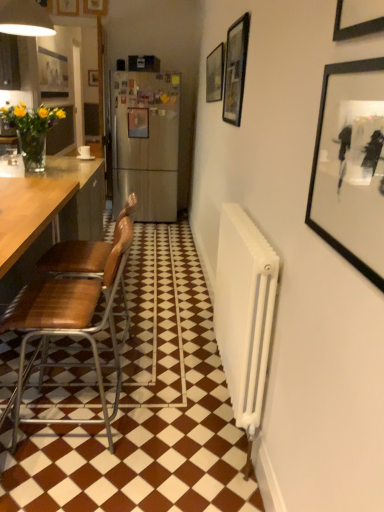
Question: Is brown leather chair at left, positioned as the 2th chair in front-to-back order, far away from matte black picture frame at upper center, marked as the fifth picture frame in a bottom-to-top arrangement?

Choices:
 (A) yes
 (B) no

Answer: (A)

Question: Is matte black picture frame at upper center, acting as the second picture frame starting from the top, a part of brown leather chair at left, positioned as the 1th chair in back-to-front order?

Choices:
 (A) yes
 (B) no

Answer: (B)

Question: Is brown leather chair at left, positioned as the 2th chair in front-to-back order, bigger than matte black picture frame at upper center, marked as the fifth picture frame in a bottom-to-top arrangement?

Choices:
 (A) yes
 (B) no

Answer: (A)

Question: Can you confirm if brown leather chair at left, positioned as the 1th chair in back-to-front order, is smaller than matte black picture frame at upper center, the 2th picture frame positioned from the left?

Choices:
 (A) no
 (B) yes

Answer: (A)

Question: Is brown leather chair at left, positioned as the 2th chair in front-to-back order, taller than matte black picture frame at upper center, the 2th picture frame positioned from the left?

Choices:
 (A) yes
 (B) no

Answer: (A)

Question: From the image's perspective, is black glass picture frame at upper center, the second picture frame in the front-to-back sequence, located above or below white glossy tile at center?

Choices:
 (A) below
 (B) above

Answer: (B)

Question: Is black glass picture frame at upper center, positioned as the 5th picture frame in left-to-right order, taller or shorter than white glossy tile at center?

Choices:
 (A) short
 (B) tall

Answer: (B)

Question: Relative to white glossy tile at center, is black glass picture frame at upper center, the second picture frame in the front-to-back sequence, in front or behind?

Choices:
 (A) behind
 (B) front

Answer: (A)

Question: Is point (225, 65) closer or farther from the camera than point (13, 496)?

Choices:
 (A) closer
 (B) farther

Answer: (B)

Question: From a real-world perspective, is brown leather chair at left, placed as the 1th chair when sorted from front to back, physically located above or below black matte picture frame at upper right, the sixth picture frame viewed from the back?

Choices:
 (A) above
 (B) below

Answer: (B)

Question: Considering the positions of brown leather chair at left, which is the second chair in back-to-front order, and black matte picture frame at upper right, the sixth picture frame viewed from the back, in the image, is brown leather chair at left, which is the second chair in back-to-front order, wider or thinner than black matte picture frame at upper right, the sixth picture frame viewed from the back,?

Choices:
 (A) wide
 (B) thin

Answer: (A)

Question: Is brown leather chair at left, which is the second chair in back-to-front order, taller or shorter than black matte picture frame at upper right, placed as the sixth picture frame when sorted from left to right?

Choices:
 (A) short
 (B) tall

Answer: (B)

Question: From the image's perspective, relative to black matte picture frame at upper right, which appears as the first picture frame when ordered from the bottom, is brown leather chair at left, placed as the 1th chair when sorted from front to back, above or below?

Choices:
 (A) above
 (B) below

Answer: (B)

Question: Considering the relative positions of matte black picture frame at upper center, marked as the fifth picture frame in a bottom-to-top arrangement, and matte black picture frame at upper center, arranged as the fourth picture frame when viewed from the back, in the image provided, is matte black picture frame at upper center, marked as the fifth picture frame in a bottom-to-top arrangement, to the left or to the right of matte black picture frame at upper center, arranged as the fourth picture frame when viewed from the back,?

Choices:
 (A) left
 (B) right

Answer: (A)

Question: In the image, is matte black picture frame at upper center, marked as the fifth picture frame in a bottom-to-top arrangement, positioned in front of or behind matte black picture frame at upper center, acting as the third picture frame starting from the right?

Choices:
 (A) front
 (B) behind

Answer: (B)